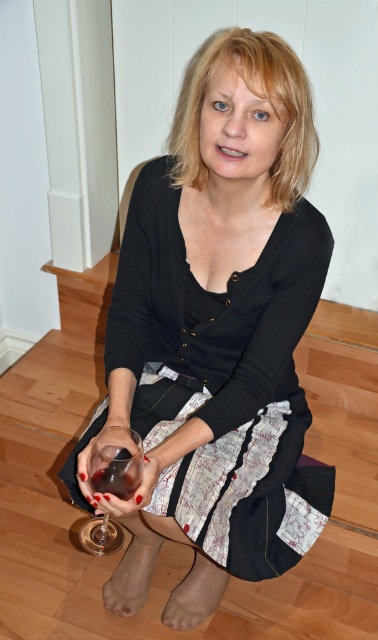
Question: Among these objects, which one is nearest to the camera?

Choices:
 (A) translucent glass at lower left
 (B) transparent glass at lower center
 (C) matte black dress at center

Answer: (C)

Question: Is transparent glass at lower center positioned before translucent glass at lower left?

Choices:
 (A) yes
 (B) no

Answer: (B)

Question: Is transparent glass at lower center positioned before translucent glass at lower left?

Choices:
 (A) yes
 (B) no

Answer: (B)

Question: Which object is closer to the camera taking this photo?

Choices:
 (A) translucent glass at lower left
 (B) transparent glass at lower center

Answer: (A)

Question: Which object is the closest to the matte black dress at center?

Choices:
 (A) translucent glass at lower left
 (B) transparent glass at lower center

Answer: (B)

Question: Does matte black dress at center appear under translucent glass at lower left?

Choices:
 (A) yes
 (B) no

Answer: (B)